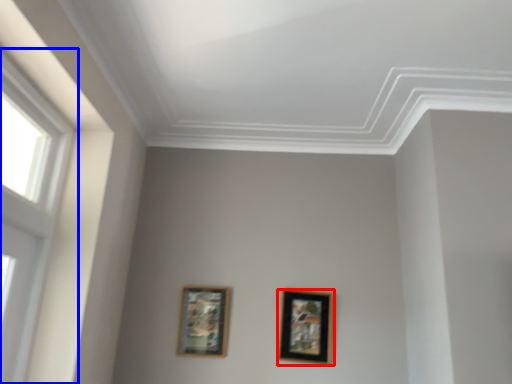
Question: Which object appears farthest to the camera in this image, picture frame (highlighted by a red box) or window (highlighted by a blue box)?

Choices:
 (A) picture frame
 (B) window

Answer: (A)